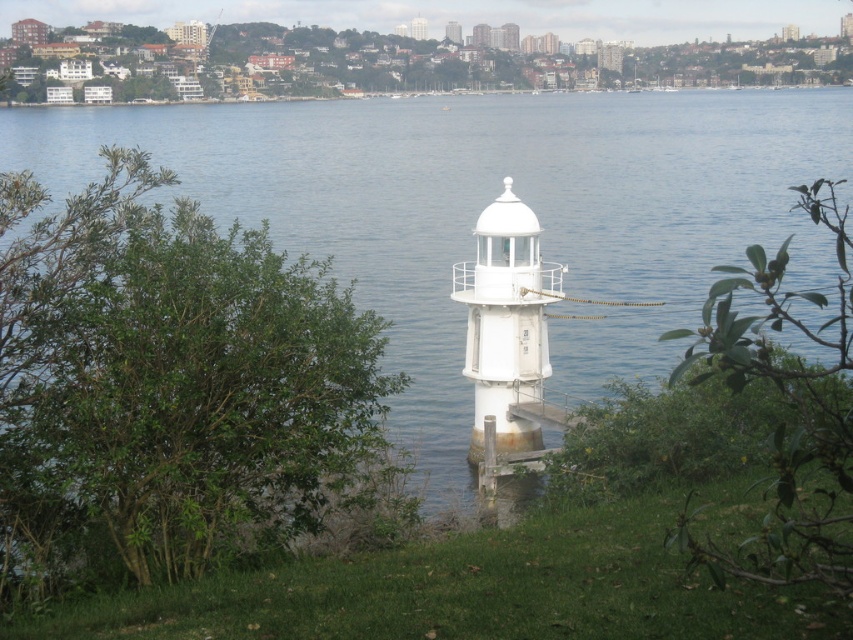
You are standing at the water edge in the scene and want to reach both points marked in the image. Which point, point (424, 314) or point (409, 26), is closer to you?

Point (424, 314) is closer to the camera than point (409, 26), so it is closer to you.